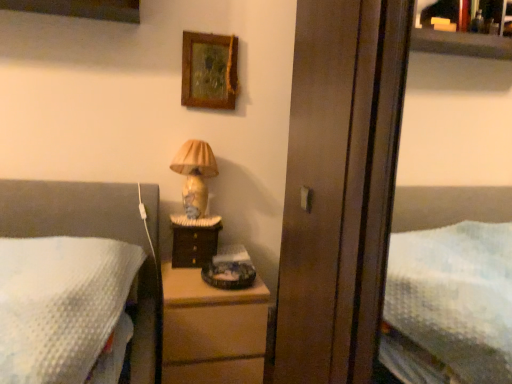
Identify the location of free spot in front of dark wood nightstand at center. (180, 275).